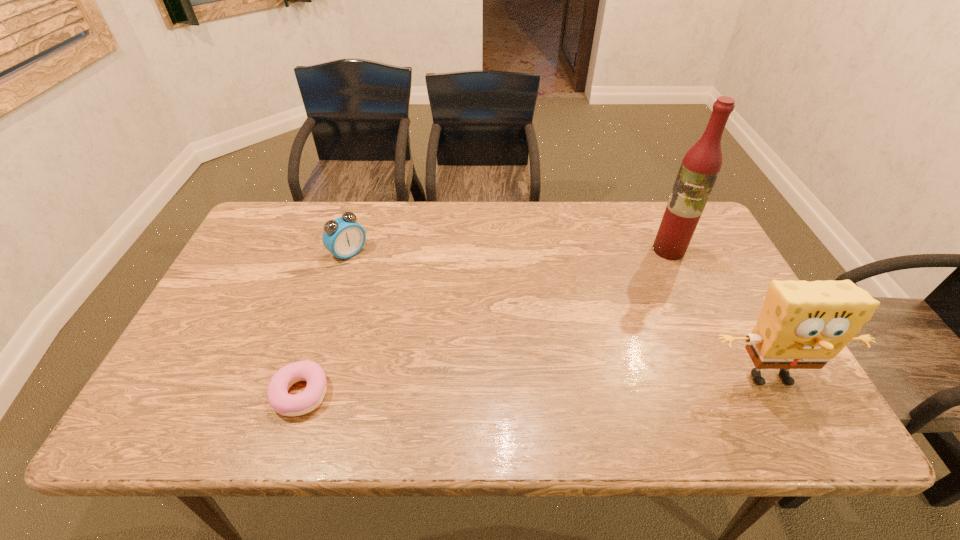
Where is `blank space at the near edge of the desktop`? blank space at the near edge of the desktop is located at coordinates (348, 379).

In the image, there is a desktop. Where is `vacant space at the left edge`? This screenshot has height=540, width=960. vacant space at the left edge is located at coordinates (213, 318).

Where is `vacant space at the right edge`? vacant space at the right edge is located at coordinates (711, 271).

This screenshot has width=960, height=540. I want to click on blank area at the far right corner, so click(x=695, y=231).

At what (x,y) coordinates should I click in order to perform the action: click on free point between the pastry and the tallest object. Please return your answer as a coordinate pair (x, y). Looking at the image, I should click on (485, 321).

This screenshot has height=540, width=960. Find the location of `vacant area that lies between the second shortest object and the tallest object`. vacant area that lies between the second shortest object and the tallest object is located at coordinates (509, 251).

Locate an element on the screen. This screenshot has width=960, height=540. empty space that is in between the pastry and the alarm clock is located at coordinates (324, 323).

Identify the location of blank region between the alarm clock and the pastry. (324, 323).

In order to click on empty location between the alarm clock and the second tallest object in this screenshot , I will do `click(559, 315)`.

The width and height of the screenshot is (960, 540). I want to click on free space between the second shortest object and the pastry, so click(x=324, y=323).